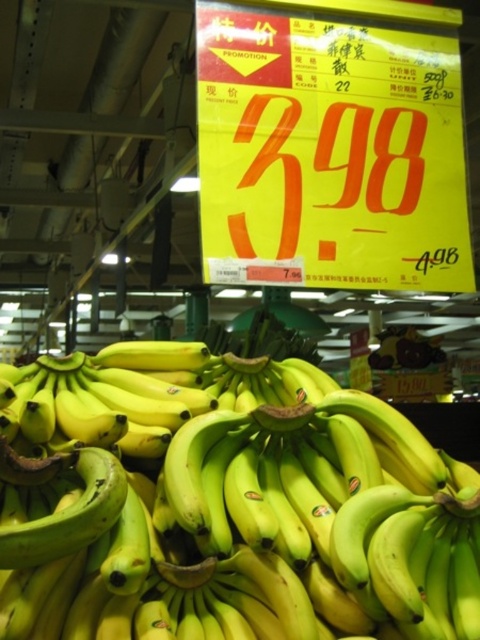
You are a customer in a grocery store looking at the banana display. You see the yellow matte bananas at center and the yellow paper sign at center. Which item is positioned to the left?

The yellow matte bananas at center is to the left of the yellow paper sign at center, so the yellow matte bananas at center is positioned to the left.